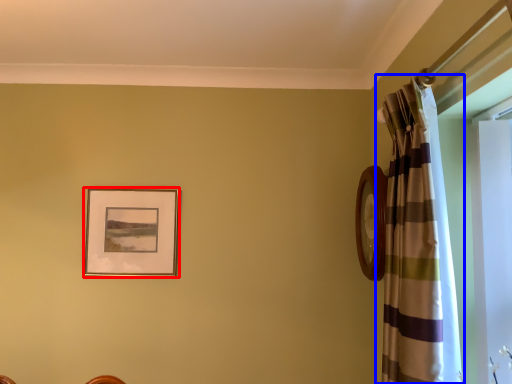
Question: Which object is closer to the camera taking this photo, picture frame (highlighted by a red box) or curtain (highlighted by a blue box)?

Choices:
 (A) picture frame
 (B) curtain

Answer: (B)